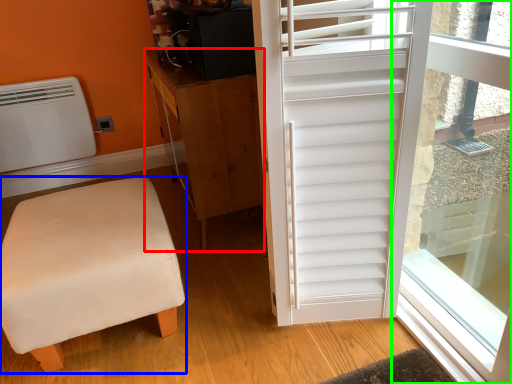
Question: Which object is positioned closest to cabinetry (highlighted by a red box)? Select from furniture (highlighted by a blue box) and window screen (highlighted by a green box).

Choices:
 (A) furniture
 (B) window screen

Answer: (A)